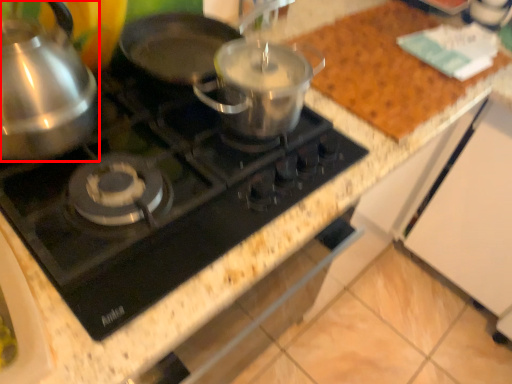
Question: From the image's perspective, what is the correct spatial relationship of kitchen appliance (annotated by the red box) in relation to gas stove?

Choices:
 (A) below
 (B) above

Answer: (B)